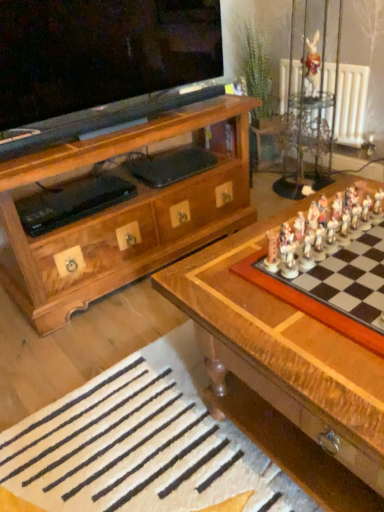
Locate an element on the screen. This screenshot has width=384, height=512. vacant space that is to the left of clear glass vase at upper right is located at coordinates (266, 189).